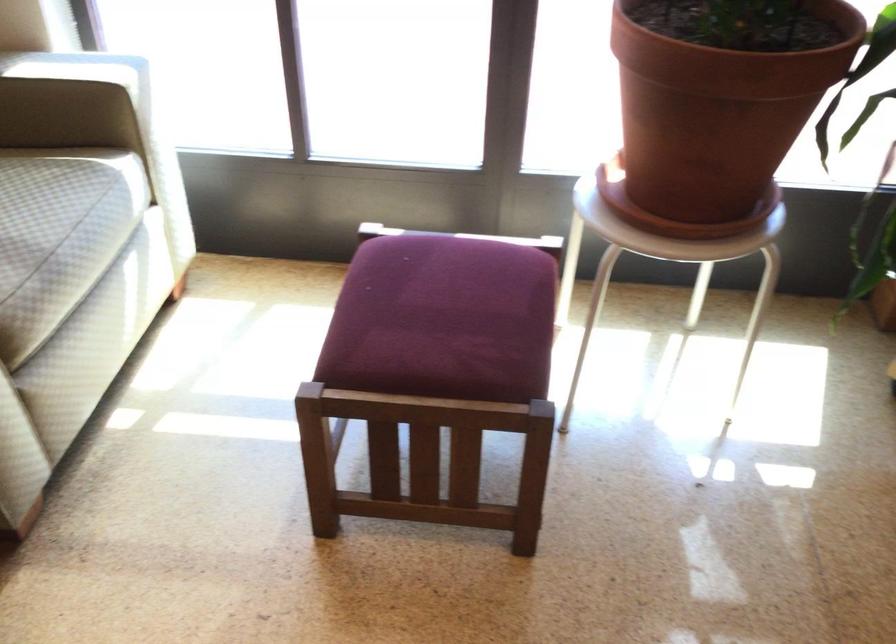
Identify the location of sofa armrest. This screenshot has height=644, width=896. (73, 69).